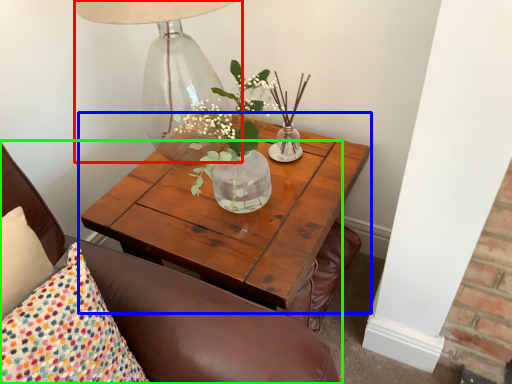
Question: Which object is the closest to the table lamp (highlighted by a red box)? Choose among these: coffee table (highlighted by a blue box) or chair (highlighted by a green box).

Choices:
 (A) coffee table
 (B) chair

Answer: (A)